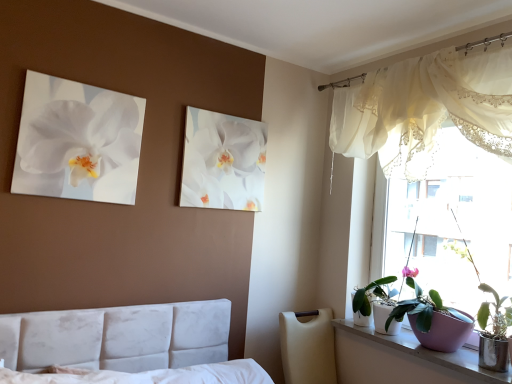
Question: Is smooth white windowsill at lower right positioned behind white glossy pot at window, arranged as the first houseplant when viewed from the back?

Choices:
 (A) no
 (B) yes

Answer: (A)

Question: Is smooth white windowsill at lower right not inside white glossy pot at window, arranged as the first houseplant when viewed from the back?

Choices:
 (A) no
 (B) yes

Answer: (B)

Question: Is smooth white windowsill at lower right thinner than white glossy pot at window, the third houseplant in the front-to-back sequence?

Choices:
 (A) yes
 (B) no

Answer: (B)

Question: Is smooth white windowsill at lower right to the left of white glossy pot at window, arranged as the first houseplant when viewed from the back, from the viewer's perspective?

Choices:
 (A) yes
 (B) no

Answer: (B)

Question: Does smooth white windowsill at lower right have a greater width compared to white glossy pot at window, arranged as the first houseplant when viewed from the back?

Choices:
 (A) yes
 (B) no

Answer: (A)

Question: Is point (110, 130) positioned closer to the camera than point (360, 291)?

Choices:
 (A) closer
 (B) farther

Answer: (A)

Question: Relative to white glossy pot at window, arranged as the first houseplant when viewed from the back, is white glossy orchid at upper left, which is counted as the 2th flower, starting from the right, in front or behind?

Choices:
 (A) front
 (B) behind

Answer: (A)

Question: Is white glossy orchid at upper left, the second flower viewed from the back, bigger or smaller than white glossy pot at window, arranged as the first houseplant when viewed from the back?

Choices:
 (A) big
 (B) small

Answer: (B)

Question: Would you say white glossy orchid at upper left, the second flower viewed from the back, is inside or outside white glossy pot at window, the third houseplant in the front-to-back sequence?

Choices:
 (A) outside
 (B) inside

Answer: (A)

Question: Is point (347, 345) closer or farther from the camera than point (419, 309)?

Choices:
 (A) farther
 (B) closer

Answer: (A)

Question: Would you say smooth white windowsill at lower right is inside or outside purple ceramic pot at window, which is counted as the second houseplant, starting from the front?

Choices:
 (A) inside
 (B) outside

Answer: (B)

Question: From the image's perspective, is smooth white windowsill at lower right above or below purple ceramic pot at window, which is counted as the second houseplant, starting from the front?

Choices:
 (A) below
 (B) above

Answer: (A)

Question: Considering the positions of smooth white windowsill at lower right and purple ceramic pot at window, which is counted as the second houseplant, starting from the front, in the image, is smooth white windowsill at lower right bigger or smaller than purple ceramic pot at window, which is counted as the second houseplant, starting from the front,?

Choices:
 (A) big
 (B) small

Answer: (B)

Question: Considering the relative positions of purple ceramic pot at window, which is the third houseplant in back-to-front order, and white glossy orchid at upper center, the second flower when ordered from left to right, in the image provided, is purple ceramic pot at window, which is the third houseplant in back-to-front order, to the left or to the right of white glossy orchid at upper center, the second flower when ordered from left to right,?

Choices:
 (A) left
 (B) right

Answer: (B)

Question: Based on their sizes in the image, would you say purple ceramic pot at window, which appears as the first houseplant when viewed from the front, is bigger or smaller than white glossy orchid at upper center, which appears as the 2th flower when viewed from the front?

Choices:
 (A) small
 (B) big

Answer: (B)